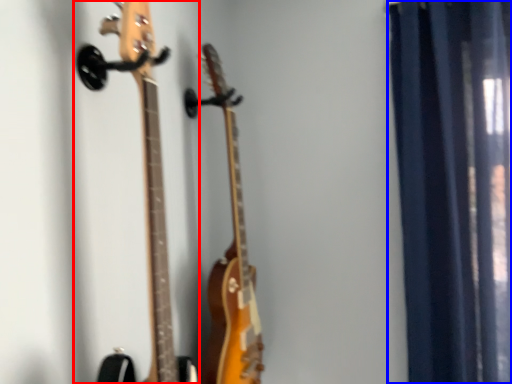
Question: Which point is closer to the camera, guitar (highlighted by a red box) or curtain (highlighted by a blue box)?

Choices:
 (A) guitar
 (B) curtain

Answer: (A)